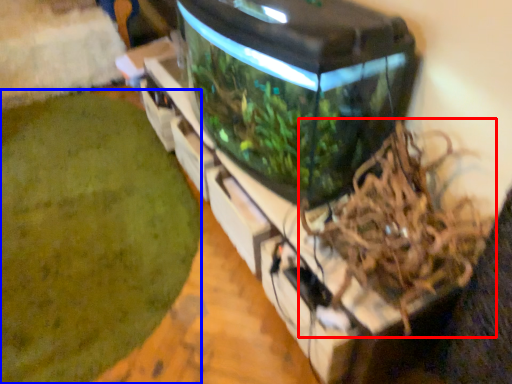
Question: Which object is further to the camera taking this photo, bird nest (highlighted by a red box) or debris (highlighted by a blue box)?

Choices:
 (A) bird nest
 (B) debris

Answer: (B)